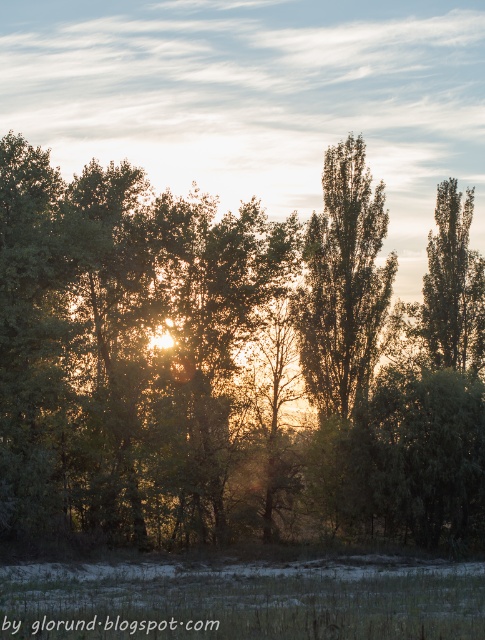
Question: Which object is farther from the camera taking this photo?

Choices:
 (A) green leafy tree at upper right
 (B) green leafy tree at center
 (C) green grass at lower center

Answer: (A)

Question: Is green leafy tree at center wider than green grass at lower center?

Choices:
 (A) no
 (B) yes

Answer: (B)

Question: Which object is positioned closest to the green leafy tree at center?

Choices:
 (A) green grass at lower center
 (B) green leafy tree at upper right

Answer: (B)

Question: Does green leafy tree at center have a larger size compared to green grass at lower center?

Choices:
 (A) yes
 (B) no

Answer: (A)

Question: Which object is the farthest from the green leafy tree at upper right?

Choices:
 (A) green grass at lower center
 (B) green leafy tree at center

Answer: (A)

Question: Is green leafy tree at center behind green leafy tree at upper right?

Choices:
 (A) no
 (B) yes

Answer: (A)